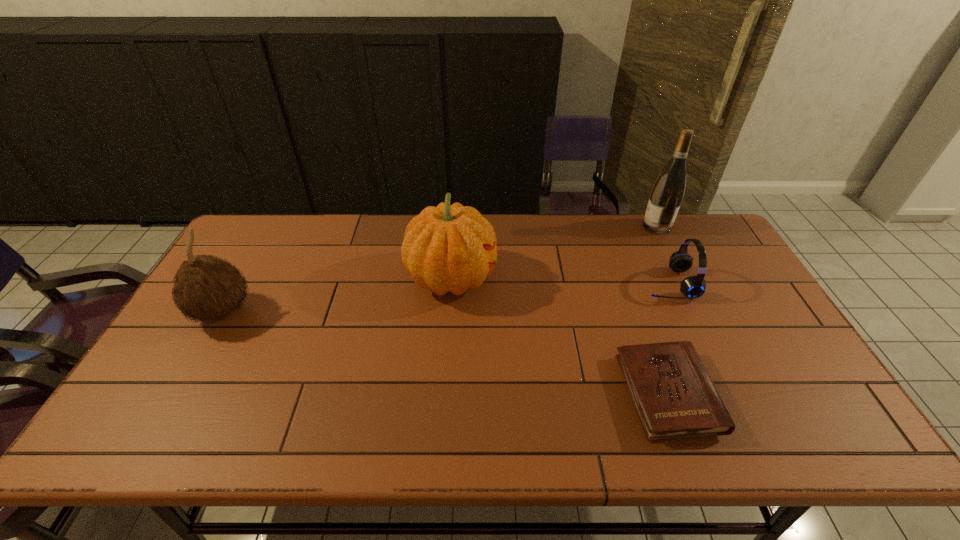
Image resolution: width=960 pixels, height=540 pixels. I want to click on object that is at the right edge, so click(x=667, y=194).

At what (x,y) coordinates should I click in order to perform the action: click on object at the far right corner. Please return your answer as a coordinate pair (x, y). The width and height of the screenshot is (960, 540). Looking at the image, I should click on (667, 194).

In the image, there is a desktop. Where is `vacant space at the far edge`? This screenshot has width=960, height=540. vacant space at the far edge is located at coordinates (547, 230).

Where is `free region at the near edge of the desktop`? free region at the near edge of the desktop is located at coordinates (738, 425).

The width and height of the screenshot is (960, 540). Identify the location of free region at the left edge of the desktop. (240, 269).

The image size is (960, 540). Find the location of `free space at the far right corner of the desktop`. free space at the far right corner of the desktop is located at coordinates (708, 224).

At what (x,y) coordinates should I click in order to perform the action: click on empty space between the shortest object and the fourth object from right to left. Please return your answer as a coordinate pair (x, y). Image resolution: width=960 pixels, height=540 pixels. Looking at the image, I should click on (559, 336).

The height and width of the screenshot is (540, 960). I want to click on free space between the second object from left to right and the farthest object, so click(x=554, y=252).

The width and height of the screenshot is (960, 540). I want to click on vacant area that lies between the farthest object and the shortest object, so click(661, 310).

Where is `vacant space that's between the fourth object from right to left and the leftmost object`? The height and width of the screenshot is (540, 960). vacant space that's between the fourth object from right to left and the leftmost object is located at coordinates (337, 295).